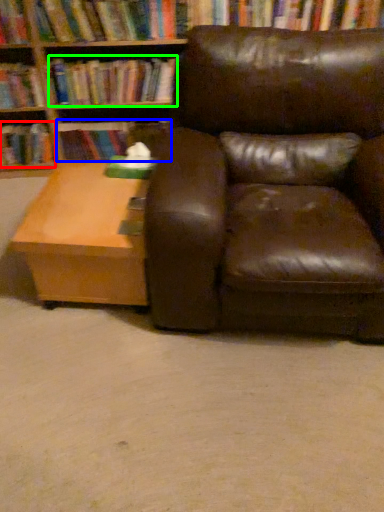
Question: Estimate the real-world distances between objects in this image. Which object is closer to book (highlighted by a red box), book (highlighted by a blue box) or book (highlighted by a green box)?

Choices:
 (A) book
 (B) book

Answer: (A)